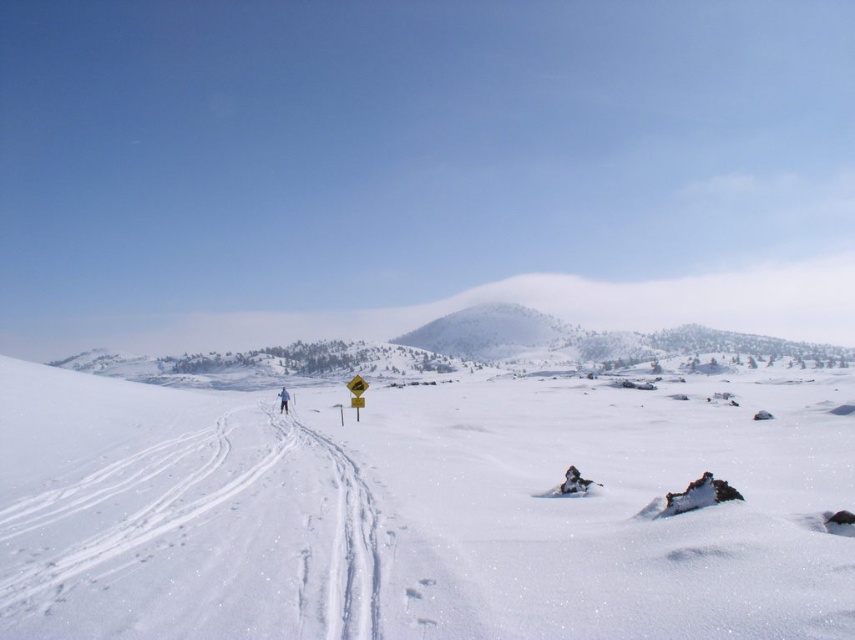
You are standing at the starting point of the ski slope and see the white snow ski slope at center and the blue fabric jacket at center. Which object is closer to your current position?

The blue fabric jacket at center is closer to your current position because the white snow ski slope at center is to the right of the blue fabric jacket at center, meaning the jacket is between you and the slope.

You are planning to place a small flag on the highest point between the white snow ski slope at center and the blue fabric jacket at center. Which object should you choose to place the flag on?

The white snow ski slope at center is taller than the blue fabric jacket at center, so you should place the flag on the white snow ski slope at center.